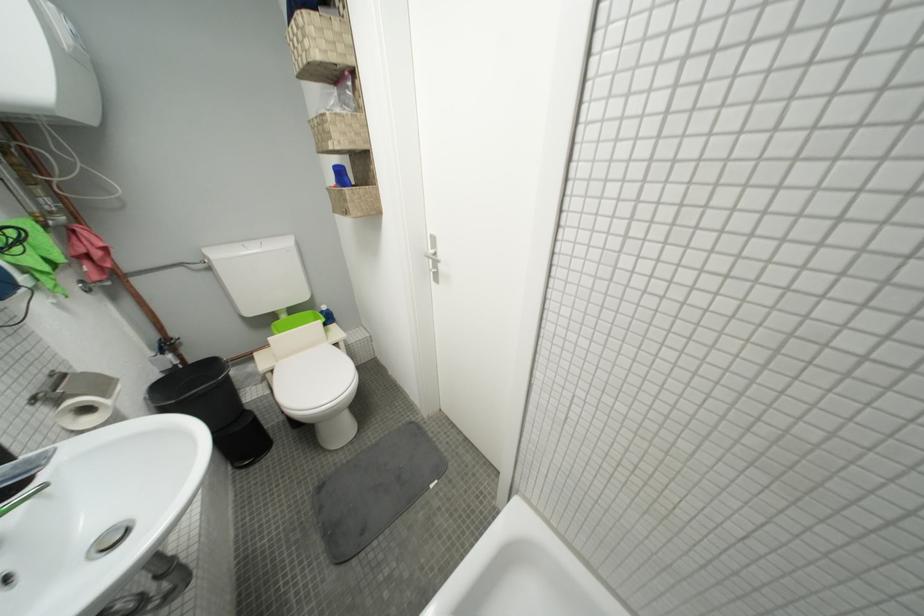
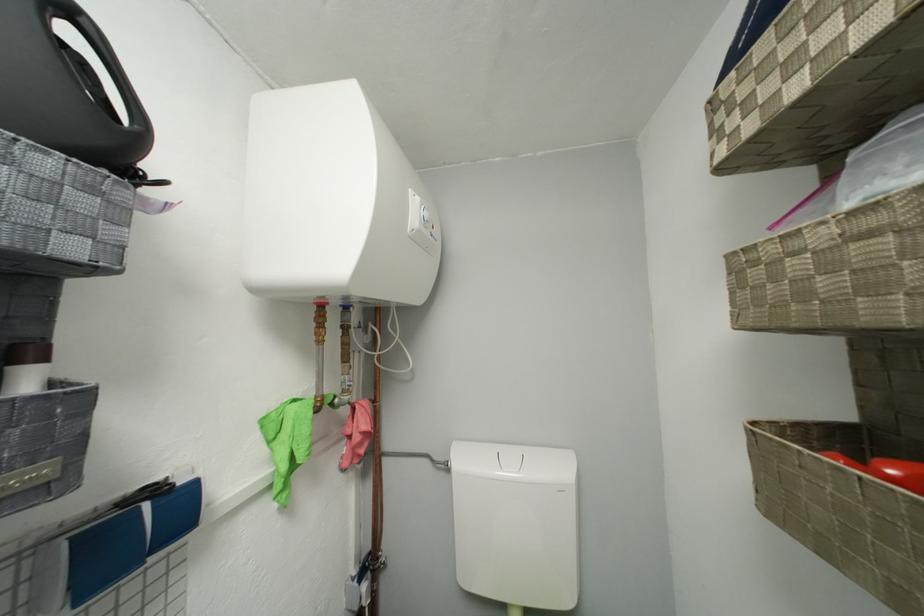
The point at [90,254] is marked in the first image. Where is the corresponding point in the second image?

(358, 435)